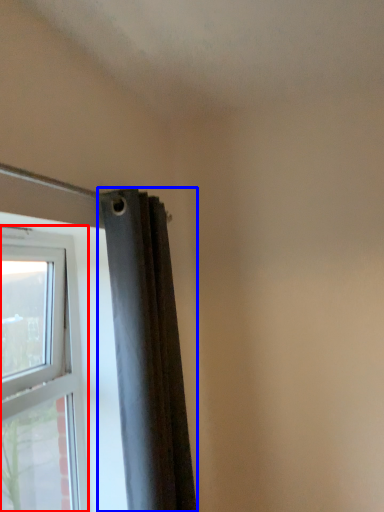
Question: Which of the following is the closest to the observer, window (highlighted by a red box) or curtain (highlighted by a blue box)?

Choices:
 (A) window
 (B) curtain

Answer: (A)